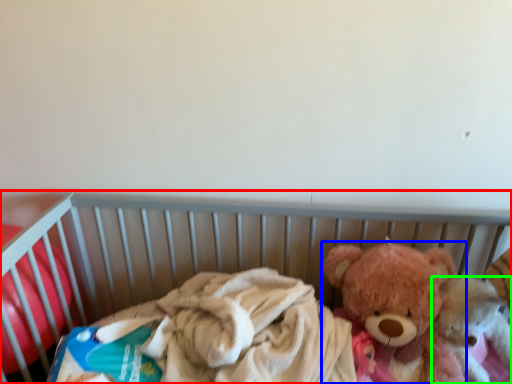
Question: Considering the real-world distances, which object is closest to infant bed (highlighted by a red box)? teddy bear (highlighted by a blue box) or teddy bear (highlighted by a green box).

Choices:
 (A) teddy bear
 (B) teddy bear

Answer: (A)